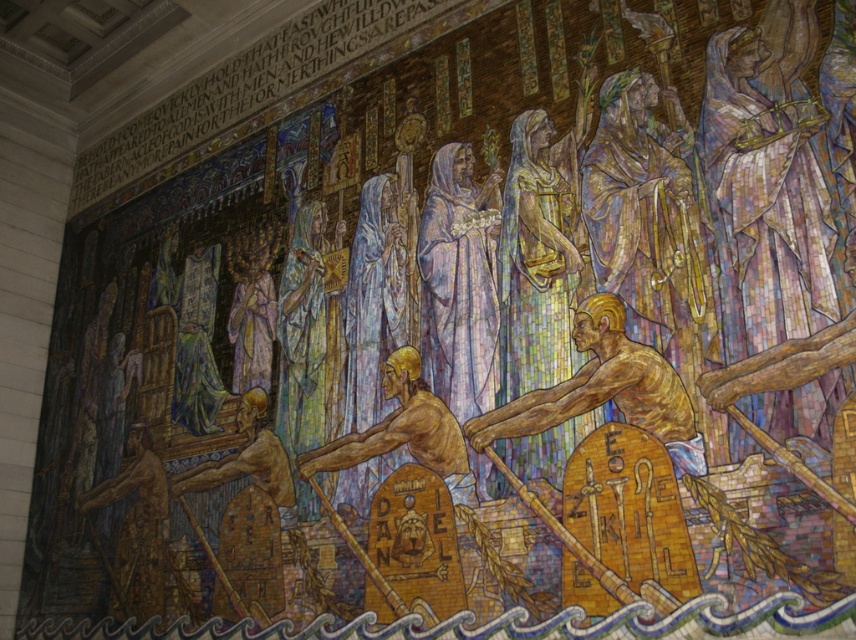
Question: Can you confirm if brown textured figure at center is smaller than brown wooden oar at lower left?

Choices:
 (A) no
 (B) yes

Answer: (A)

Question: Which of the following is the closest to the observer?

Choices:
 (A) brown textured figure at center
 (B) pastel silk robe at center

Answer: (A)

Question: Is golden textured figure at center smaller than brown wooden oar at lower left?

Choices:
 (A) yes
 (B) no

Answer: (B)

Question: Based on their relative distances, which object is nearer to the brown wooden oar at lower left?

Choices:
 (A) golden textured figure at center
 (B) brown textured figure at center

Answer: (B)

Question: Can you confirm if golden textured figure at center is bigger than brown textured figure at center?

Choices:
 (A) yes
 (B) no

Answer: (B)

Question: Which object is positioned closest to the brown wooden oar at lower left?

Choices:
 (A) pastel silk robe at center
 (B) golden textured figure at center

Answer: (A)